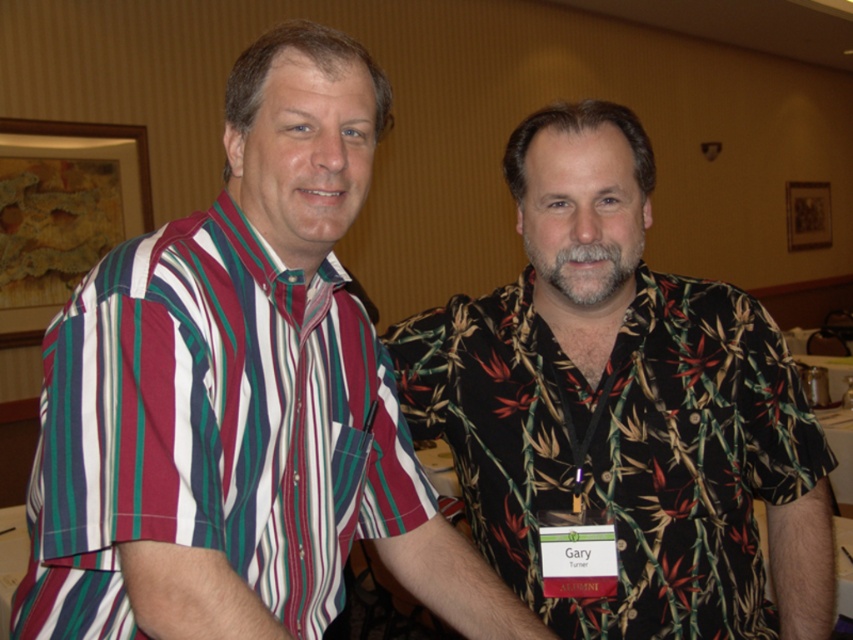
Who is positioned more to the right, black floral shirt at right or striped cotton shirt at left?

black floral shirt at right is more to the right.

Is black floral shirt at right shorter than striped cotton shirt at left?

No.

Which is behind, point (532, 396) or point (138, 486)?

The point (532, 396) is behind.

At what (x,y) coordinates should I click in order to perform the action: click on black floral shirt at right. Please return your answer as a coordinate pair (x, y). Looking at the image, I should click on (624, 404).